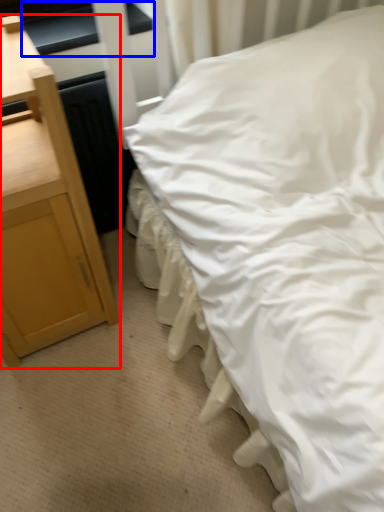
Question: Which point is closer to the camera, nightstand (highlighted by a red box) or window sill (highlighted by a blue box)?

Choices:
 (A) nightstand
 (B) window sill

Answer: (A)